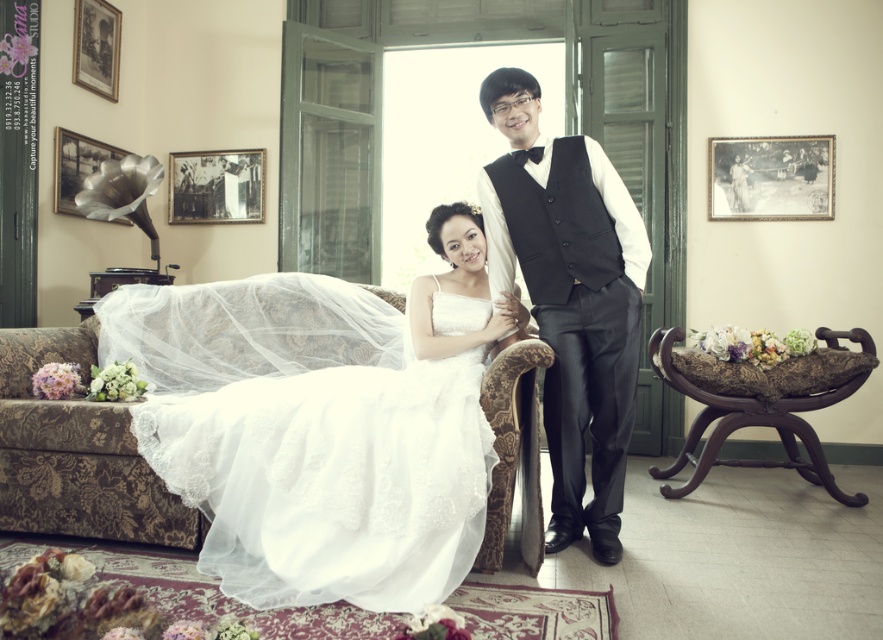
Where is `white lace dress at center`? white lace dress at center is located at coordinates (351, 454).

Is white lace dress at center smaller than black satin vest at center?

Incorrect, white lace dress at center is not smaller in size than black satin vest at center.

Is point (438, 368) positioned behind point (523, 205)?

Yes, point (438, 368) is behind point (523, 205).

Locate an element on the screen. The image size is (883, 640). white lace dress at center is located at coordinates (351, 454).

Is black satin vest at center positioned before brown wood armchair at right?

Yes, black satin vest at center is closer to the viewer.

Is point (545, 188) positioned in front of point (813, 461)?

That is True.

At what (x,y) coordinates should I click in order to perform the action: click on black satin vest at center. Please return your answer as a coordinate pair (x, y). This screenshot has height=640, width=883. Looking at the image, I should click on (570, 298).

Does white lace dress at center appear under brown wood armchair at right?

Actually, white lace dress at center is above brown wood armchair at right.

Is white lace dress at center above brown wood armchair at right?

Yes.

Identify the location of white lace dress at center. (351, 454).